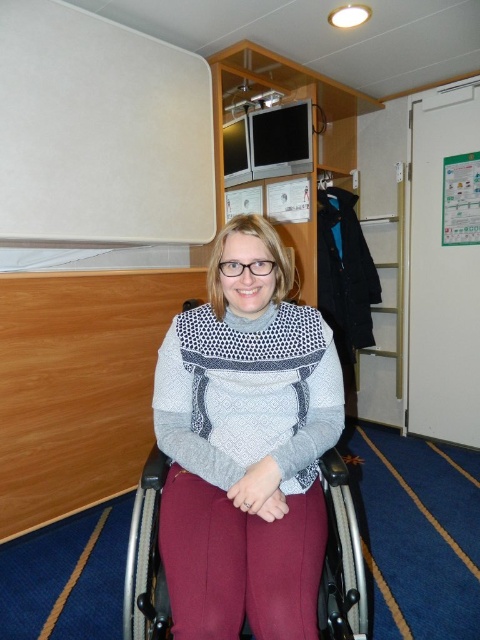
Which of these two, knitted sweater at center or knitted gray sweater at center, stands shorter?

With less height is knitted gray sweater at center.

Is knitted sweater at center smaller than knitted gray sweater at center?

Incorrect, knitted sweater at center is not smaller in size than knitted gray sweater at center.

Is point (181, 500) more distant than point (274, 387)?

No, (181, 500) is closer to viewer.

The height and width of the screenshot is (640, 480). I want to click on knitted sweater at center, so click(x=245, y=445).

Does knitted gray sweater at center appear on the left side of maroon leggings at center?

No, knitted gray sweater at center is not to the left of maroon leggings at center.

Is point (181, 376) farther from viewer compared to point (225, 538)?

Yes, point (181, 376) is behind point (225, 538).

Who is more distant from viewer, (237,397) or (205,500)?

Positioned behind is point (237,397).

This screenshot has height=640, width=480. Find the location of `knitted gray sweater at center`. knitted gray sweater at center is located at coordinates (249, 394).

Does maroon leggings at center appear over knitted wool sweater at center?

Incorrect, maroon leggings at center is not positioned above knitted wool sweater at center.

Which of these two, maroon leggings at center or knitted wool sweater at center, stands shorter?

maroon leggings at center is shorter.

Measure the distance between maroon leggings at center and camera.

maroon leggings at center and camera are 95.73 centimeters apart from each other.

This screenshot has height=640, width=480. In order to click on maroon leggings at center in this screenshot , I will do `click(240, 563)`.